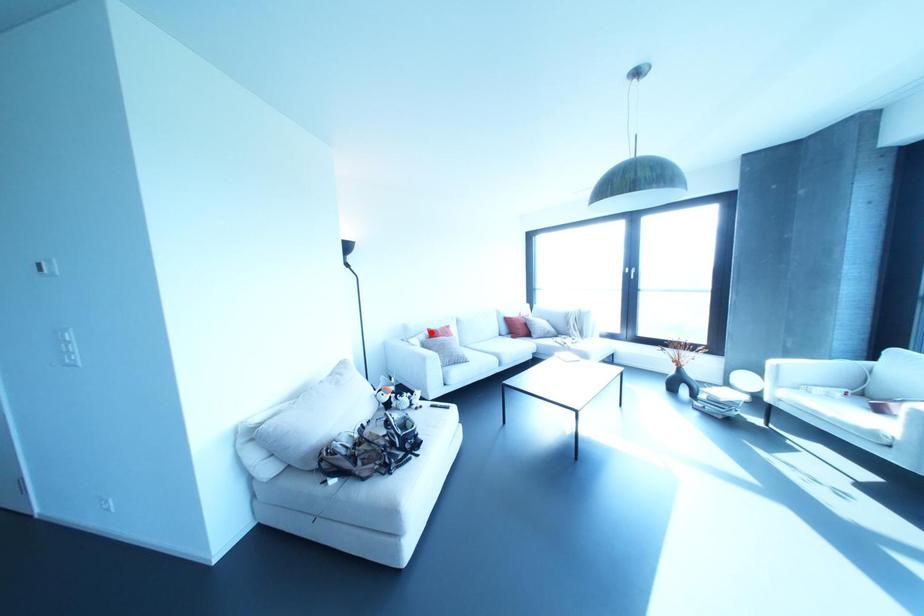
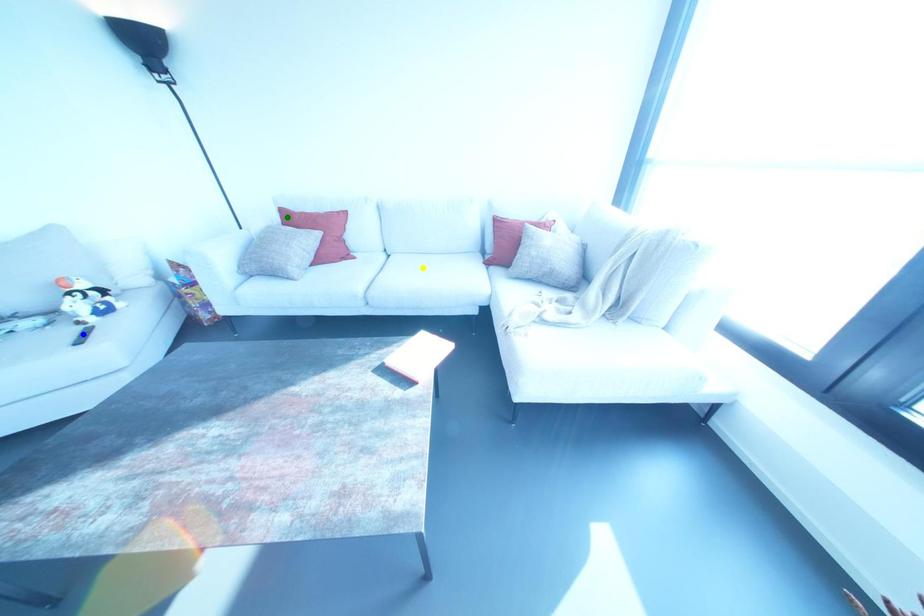
Question: I am providing you with two images of the same scene from different viewpoints. A red point is marked on the first image. You are given multiple points on the second image. In image 2, which mark is for the same physical point as the one in image 1?

Choices:
 (A) blue point
 (B) yellow point
 (C) green point

Answer: (C)